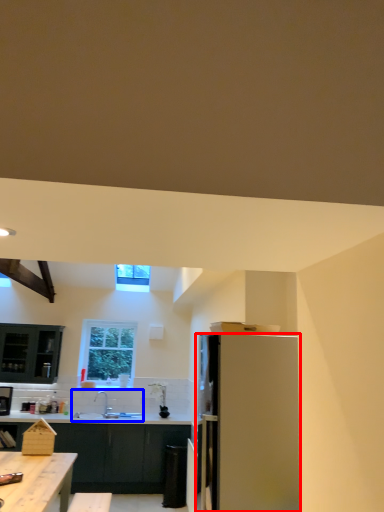
Question: Among these objects, which one is farthest to the camera, refrigerator (highlighted by a red box) or sink (highlighted by a blue box)?

Choices:
 (A) refrigerator
 (B) sink

Answer: (B)